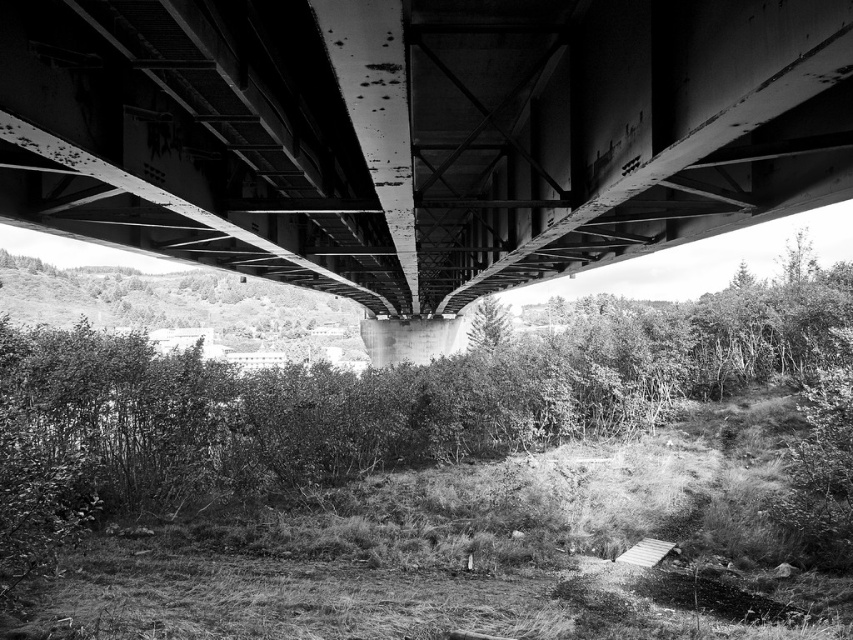
Between point (86, 157) and point (93, 364), which one is positioned in front?

Point (86, 157) is more forward.

Where is `rusty metal bridge at center`? rusty metal bridge at center is located at coordinates (418, 134).